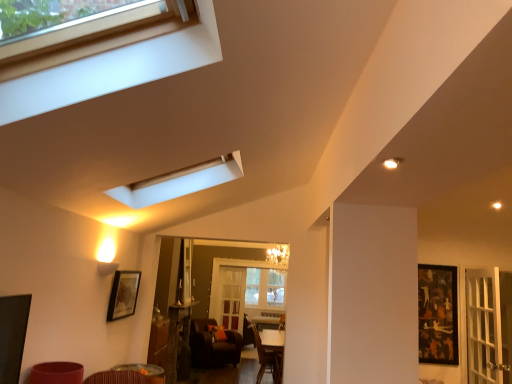
Image resolution: width=512 pixels, height=384 pixels. What do you see at coordinates (144, 371) in the screenshot? I see `wooden table at lower center, which is counted as the 2th table, starting from the back` at bounding box center [144, 371].

Where is `dark brown leather armchair at center`? The image size is (512, 384). dark brown leather armchair at center is located at coordinates (267, 359).

The height and width of the screenshot is (384, 512). What do you see at coordinates (113, 70) in the screenshot? I see `wooden frame window at upper left` at bounding box center [113, 70].

I want to click on black glossy picture frame at right, arranged as the first picture frame when viewed from the right, so [438, 314].

Does wooden table at center, which is counted as the 2th table, starting from the front, lie in front of black glossy picture frame at right, arranged as the first picture frame when viewed from the right?

No, wooden table at center, which is counted as the 2th table, starting from the front, is further to the viewer.

Between point (188, 303) and point (426, 333), which one is positioned in front?

The point (188, 303) is more forward.

Choose the correct answer: Is wooden table at center, positioned as the second table in top-to-bottom order, inside black glossy picture frame at right, which ranks as the second picture frame in front-to-back order, or outside it?

The correct answer is: outside.

From the image's perspective, relative to black glossy picture frame at right, which ranks as the second picture frame in front-to-back order, is wooden table at center, placed as the first table when sorted from bottom to top, above or below?

Based on their image positions, wooden table at center, placed as the first table when sorted from bottom to top, is located beneath black glossy picture frame at right, which ranks as the second picture frame in front-to-back order.

Identify the location of picture frame on the left of dark brown leather armchair at center. This screenshot has height=384, width=512. (123, 295).

Which is behind, point (257, 376) or point (131, 306)?

The point (257, 376) is farther from the camera.

In terms of height, does dark brown leather armchair at center look taller or shorter compared to matte black picture frame at lower left, placed as the 2th picture frame when sorted from right to left?

Clearly, dark brown leather armchair at center is taller compared to matte black picture frame at lower left, placed as the 2th picture frame when sorted from right to left.

Are dark brown leather armchair at center and matte black picture frame at lower left, placed as the 1th picture frame when sorted from front to back, located far from each other?

Yes.

Considering the sizes of objects wooden table at lower center, which is counted as the 1th table, starting from the top, and wooden frame window at upper left in the image provided, who is shorter, wooden table at lower center, which is counted as the 1th table, starting from the top, or wooden frame window at upper left?

With less height is wooden table at lower center, which is counted as the 1th table, starting from the top.

Which object is positioned more to the left, wooden table at lower center, the 1th table in the front-to-back sequence, or wooden frame window at upper left?

wooden table at lower center, the 1th table in the front-to-back sequence, is more to the left.

Considering the positions of objects wooden table at lower center, which is counted as the 1th table, starting from the top, and wooden frame window at upper left in the image provided, who is behind, wooden table at lower center, which is counted as the 1th table, starting from the top, or wooden frame window at upper left?

wooden table at lower center, which is counted as the 1th table, starting from the top, is further away from the camera.

From the image's perspective, is wooden table at lower center, the 1th table in the front-to-back sequence, located above or below wooden frame window at upper left?

Clearly, from the image's perspective, wooden table at lower center, the 1th table in the front-to-back sequence, is below wooden frame window at upper left.

Considering the sizes of objects brown leather chair at lower center and black glossy picture frame at right, which ranks as the second picture frame in front-to-back order, in the image provided, who is smaller, brown leather chair at lower center or black glossy picture frame at right, which ranks as the second picture frame in front-to-back order,?

With smaller size is black glossy picture frame at right, which ranks as the second picture frame in front-to-back order.

Does brown leather chair at lower center appear on the right side of black glossy picture frame at right, marked as the 2th picture frame in a left-to-right arrangement?

Incorrect, brown leather chair at lower center is not on the right side of black glossy picture frame at right, marked as the 2th picture frame in a left-to-right arrangement.

The image size is (512, 384). I want to click on chair on the left of black glossy picture frame at right, which is the 1th picture frame from back to front, so point(213,346).

From the image's perspective, is brown leather chair at lower center beneath black glossy picture frame at right, which ranks as the second picture frame in front-to-back order?

Yes, from the image's perspective, brown leather chair at lower center is beneath black glossy picture frame at right, which ranks as the second picture frame in front-to-back order.

From a real-world perspective, is dark brown leather armchair at center above or below brown leather chair at lower center?

dark brown leather armchair at center is situated higher than brown leather chair at lower center in the real world.

Is dark brown leather armchair at center aimed at brown leather chair at lower center?

No, dark brown leather armchair at center is not oriented towards brown leather chair at lower center.

How different are the orientations of dark brown leather armchair at center and brown leather chair at lower center in degrees?

46.1 degrees.

Is point (278, 374) positioned before point (227, 338)?

Yes, it is in front of point (227, 338).

What's the angular difference between wooden table at lower center, which is counted as the 2th table, starting from the back, and dark brown leather armchair at center's facing directions?

wooden table at lower center, which is counted as the 2th table, starting from the back, and dark brown leather armchair at center are facing 0.418 degrees away from each other.

Between wooden table at lower center, which is counted as the 1th table, starting from the top, and dark brown leather armchair at center, which one has smaller size?

wooden table at lower center, which is counted as the 1th table, starting from the top, is smaller.

Locate an element on the screen. The image size is (512, 384). armchair on the right side of wooden table at lower center, the 1th table in the front-to-back sequence is located at coordinates pos(267,359).

From a real-world perspective, is wooden table at lower center, the 1th table in the front-to-back sequence, located higher than dark brown leather armchair at center?

Yes.

Is black glossy picture frame at right, which ranks as the second picture frame in front-to-back order, positioned with its back to brown leather chair at lower center?

black glossy picture frame at right, which ranks as the second picture frame in front-to-back order, does not have its back to brown leather chair at lower center.

From the image's perspective, is black glossy picture frame at right, marked as the 2th picture frame in a left-to-right arrangement, located above or below brown leather chair at lower center?

black glossy picture frame at right, marked as the 2th picture frame in a left-to-right arrangement, is above brown leather chair at lower center.

Does point (441, 337) appear closer or farther from the camera than point (208, 349)?

Point (441, 337) is farther from the camera than point (208, 349).

Between black glossy picture frame at right, which ranks as the second picture frame in front-to-back order, and brown leather chair at lower center, which one has larger size?

Bigger between the two is brown leather chair at lower center.

I want to click on the 1st picture frame in front of the wooden table at center, the 1th table in the back-to-front sequence, so click(438, 314).

Identify the location of armchair on the right of matte black picture frame at lower left, placed as the 1th picture frame when sorted from front to back. (267, 359).

Based on their spatial positions, is wooden table at lower center, which is counted as the 1th table, starting from the top, or wooden table at center, positioned as the second table in top-to-bottom order, closer to clear glass screen door at center?

wooden table at center, positioned as the second table in top-to-bottom order.

Looking at the image, which one is located closer to wooden frame window at upper left, brown leather chair at lower center or wooden table at center, which is counted as the 2th table, starting from the front?

Among the two, wooden table at center, which is counted as the 2th table, starting from the front, is located nearer to wooden frame window at upper left.

Considering their positions, is wooden frame window at upper left positioned closer to black glossy picture frame at right, arranged as the first picture frame when viewed from the right, than wooden table at center, positioned as the second table in top-to-bottom order?

wooden table at center, positioned as the second table in top-to-bottom order, is closer to black glossy picture frame at right, arranged as the first picture frame when viewed from the right.

Looking at the image, which one is located further to brown leather chair at lower center, dark brown leather armchair at center or wooden table at lower center, which is counted as the 2th table, starting from the back?

wooden table at lower center, which is counted as the 2th table, starting from the back.

Which object lies further to the anchor point matte black picture frame at lower left, placed as the 2th picture frame when sorted from right to left, clear glass screen door at center or black glossy picture frame at right, arranged as the first picture frame when viewed from the right?

black glossy picture frame at right, arranged as the first picture frame when viewed from the right, lies further to matte black picture frame at lower left, placed as the 2th picture frame when sorted from right to left, than the other object.

Which object lies nearer to the anchor point clear glass screen door at center, black glossy picture frame at right, arranged as the first picture frame when viewed from the right, or wooden table at center, the 1th table in the back-to-front sequence?

Among the two, wooden table at center, the 1th table in the back-to-front sequence, is located nearer to clear glass screen door at center.

Considering their positions, is wooden table at center, placed as the first table when sorted from bottom to top, positioned closer to clear glass screen door at center than dark brown leather armchair at center?

dark brown leather armchair at center.

Looking at the image, which one is located closer to matte black picture frame at lower left, placed as the 1th picture frame when sorted from front to back, wooden frame window at upper left or brown leather chair at lower center?

Among the two, brown leather chair at lower center is located nearer to matte black picture frame at lower left, placed as the 1th picture frame when sorted from front to back.

Find the location of a particular element. The image size is (512, 384). armchair between wooden frame window at upper left and brown leather chair at lower center in the front-back direction is located at coordinates (267, 359).

Locate an element on the screen. picture frame between wooden frame window at upper left and black glossy picture frame at right, marked as the 2th picture frame in a left-to-right arrangement, from front to back is located at coordinates (123, 295).

At what (x,y) coordinates should I click in order to perform the action: click on picture frame between matte black picture frame at lower left, acting as the 1th picture frame starting from the left, and brown leather chair at lower center from front to back. Please return your answer as a coordinate pair (x, y). Looking at the image, I should click on click(438, 314).

The image size is (512, 384). Identify the location of armchair located between black glossy picture frame at right, which ranks as the second picture frame in front-to-back order, and clear glass screen door at center in the depth direction. (267, 359).